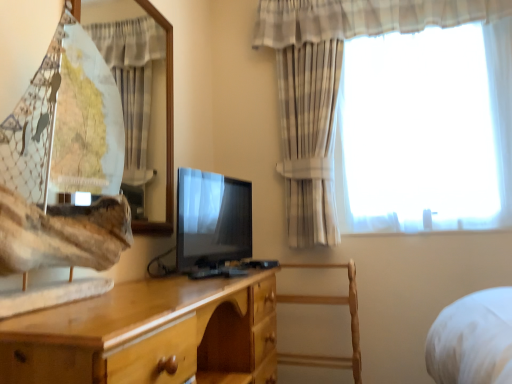
Locate an element on the screen. The width and height of the screenshot is (512, 384). matte black tv at center is located at coordinates (212, 218).

This screenshot has width=512, height=384. In order to click on plaid fabric curtain at upper right, the 1th curtain from the right in this screenshot , I will do `click(332, 86)`.

This screenshot has width=512, height=384. What do you see at coordinates (328, 304) in the screenshot?
I see `wooden chair at center` at bounding box center [328, 304].

Where is `matte black tv at center`? The image size is (512, 384). matte black tv at center is located at coordinates (212, 218).

Is wooden chair at center thinner than plaid fabric curtain at upper right, the 1th curtain from the right?

In fact, wooden chair at center might be wider than plaid fabric curtain at upper right, the 1th curtain from the right.

Find the location of a particular element. curtain on the right of wooden chair at center is located at coordinates (332, 86).

Could you tell me if wooden chair at center is facing plaid fabric curtain at upper right, the second curtain in the left-to-right sequence?

No.

Is wooden chair at center bigger than plaid fabric curtain at upper right, the second curtain in the left-to-right sequence?

No, wooden chair at center is not bigger than plaid fabric curtain at upper right, the second curtain in the left-to-right sequence.

Between plaid fabric curtain at upper left, acting as the second curtain starting from the right, and light wood chest of drawers at center, which one has more height?

plaid fabric curtain at upper left, acting as the second curtain starting from the right.

From the image's perspective, is plaid fabric curtain at upper left, placed as the 1th curtain when sorted from left to right, located above light wood chest of drawers at center?

Yes.

Which of these two, plaid fabric curtain at upper left, acting as the second curtain starting from the right, or matte black tv at center, stands taller?

plaid fabric curtain at upper left, acting as the second curtain starting from the right, is taller.

From the image's perspective, which is above, plaid fabric curtain at upper left, acting as the second curtain starting from the right, or matte black tv at center?

plaid fabric curtain at upper left, acting as the second curtain starting from the right.

The width and height of the screenshot is (512, 384). What are the coordinates of `television behind the plaid fabric curtain at upper left, acting as the second curtain starting from the right` in the screenshot? It's located at (212, 218).

Which object is closer to the camera taking this photo, plaid fabric curtain at upper left, placed as the 1th curtain when sorted from left to right, or matte black tv at center?

plaid fabric curtain at upper left, placed as the 1th curtain when sorted from left to right, is in front.

Which point is more distant from viewer, (355,287) or (72,305)?

Positioned behind is point (355,287).

Looking at this image, what's the angular difference between wooden chair at center and light wood chest of drawers at center's facing directions?

The facing directions of wooden chair at center and light wood chest of drawers at center are 90 degrees apart.

From the picture: From the image's perspective, does wooden chair at center appear higher than light wood chest of drawers at center?

No, from the image's perspective, wooden chair at center is not on top of light wood chest of drawers at center.

Is wooden chair at center aimed at light wood chest of drawers at center?

Yes, wooden chair at center is aimed at light wood chest of drawers at center.

From the image's perspective, is matte black tv at center located beneath plaid fabric curtain at upper left, acting as the second curtain starting from the right?

Yes.

In the scene shown: Considering the relative sizes of matte black tv at center and plaid fabric curtain at upper left, acting as the second curtain starting from the right, in the image provided, is matte black tv at center taller than plaid fabric curtain at upper left, acting as the second curtain starting from the right,?

Incorrect, the height of matte black tv at center is not larger of that of plaid fabric curtain at upper left, acting as the second curtain starting from the right.

Is matte black tv at center thinner than plaid fabric curtain at upper left, acting as the second curtain starting from the right?

No.

From a real-world perspective, relative to plaid fabric curtain at upper left, placed as the 1th curtain when sorted from left to right, is light wood chest of drawers at center vertically above or below?

light wood chest of drawers at center is situated lower than plaid fabric curtain at upper left, placed as the 1th curtain when sorted from left to right, in the real world.

Consider the image. Is light wood chest of drawers at center further to the viewer compared to plaid fabric curtain at upper left, acting as the second curtain starting from the right?

No, light wood chest of drawers at center is closer to the viewer.

From the image's perspective, which is above, light wood chest of drawers at center or plaid fabric curtain at upper left, acting as the second curtain starting from the right?

plaid fabric curtain at upper left, acting as the second curtain starting from the right, appears higher in the image.

Is light wood chest of drawers at center shorter than plaid fabric curtain at upper left, placed as the 1th curtain when sorted from left to right?

Yes.

This screenshot has height=384, width=512. What are the coordinates of `chair below the matte black tv at center (from a real-world perspective)` in the screenshot? It's located at (328, 304).

Is point (311, 362) farther from camera compared to point (203, 245)?

Yes, point (311, 362) is farther from viewer.

From a real-world perspective, is wooden chair at center above or below matte black tv at center?

wooden chair at center is situated lower than matte black tv at center in the real world.

From the image's perspective, which one is positioned lower, wooden chair at center or matte black tv at center?

wooden chair at center, from the image's perspective.

Identify the location of chair below the plaid fabric curtain at upper right, the 1th curtain from the right (from a real-world perspective). This screenshot has width=512, height=384. (328, 304).

At what (x,y) coordinates should I click in order to perform the action: click on the 1st curtain above the light wood chest of drawers at center (from the image's perspective). Please return your answer as a coordinate pair (x, y). Looking at the image, I should click on (136, 96).

When comparing their distances from plaid fabric curtain at upper right, the second curtain in the left-to-right sequence, does wooden chair at center or matte black tv at center seem further?

wooden chair at center.

Which object lies further to the anchor point light wood chest of drawers at center, plaid fabric curtain at upper left, acting as the second curtain starting from the right, or plaid fabric curtain at upper right, the 1th curtain from the right?

plaid fabric curtain at upper left, acting as the second curtain starting from the right.

Based on their spatial positions, is light wood chest of drawers at center or plaid fabric curtain at upper left, acting as the second curtain starting from the right, closer to matte black tv at center?

light wood chest of drawers at center.

From the image, which object appears to be nearer to light wood chest of drawers at center, plaid fabric curtain at upper right, the second curtain in the left-to-right sequence, or wooden chair at center?

Based on the image, wooden chair at center appears to be nearer to light wood chest of drawers at center.

Based on their spatial positions, is plaid fabric curtain at upper left, placed as the 1th curtain when sorted from left to right, or plaid fabric curtain at upper right, the second curtain in the left-to-right sequence, closer to matte black tv at center?

plaid fabric curtain at upper left, placed as the 1th curtain when sorted from left to right, is closer to matte black tv at center.

Which object lies nearer to the anchor point matte black tv at center, plaid fabric curtain at upper right, the 1th curtain from the right, or wooden chair at center?

The object closer to matte black tv at center is wooden chair at center.

From the image, which object appears to be nearer to matte black tv at center, light wood chest of drawers at center or plaid fabric curtain at upper right, the 1th curtain from the right?

Based on the image, light wood chest of drawers at center appears to be nearer to matte black tv at center.

Consider the image. From the image, which object appears to be nearer to plaid fabric curtain at upper left, acting as the second curtain starting from the right, plaid fabric curtain at upper right, the second curtain in the left-to-right sequence, or light wood chest of drawers at center?

plaid fabric curtain at upper right, the second curtain in the left-to-right sequence.

Image resolution: width=512 pixels, height=384 pixels. In order to click on television between light wood chest of drawers at center and wooden chair at center from front to back in this screenshot , I will do `click(212, 218)`.

Identify the location of television between plaid fabric curtain at upper right, the 1th curtain from the right, and wooden chair at center in the up-down direction. (212, 218).

I want to click on television between plaid fabric curtain at upper left, placed as the 1th curtain when sorted from left to right, and plaid fabric curtain at upper right, the second curtain in the left-to-right sequence, so click(212, 218).

Where is `curtain between light wood chest of drawers at center and matte black tv at center along the z-axis`? This screenshot has height=384, width=512. curtain between light wood chest of drawers at center and matte black tv at center along the z-axis is located at coordinates (136, 96).